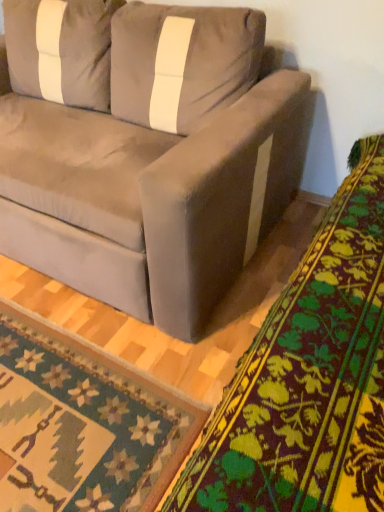
Measure the distance between point [33,156] and camera.

5.12 feet.

The image size is (384, 512). Describe the element at coordinates (145, 150) in the screenshot. I see `suede gray couch at center` at that location.

Identify the location of suede gray couch at center. The height and width of the screenshot is (512, 384). (145, 150).

What is the approximate height of suede gray couch at center?

suede gray couch at center is 35.16 inches tall.

Where is `suede gray couch at center`? suede gray couch at center is located at coordinates (145, 150).